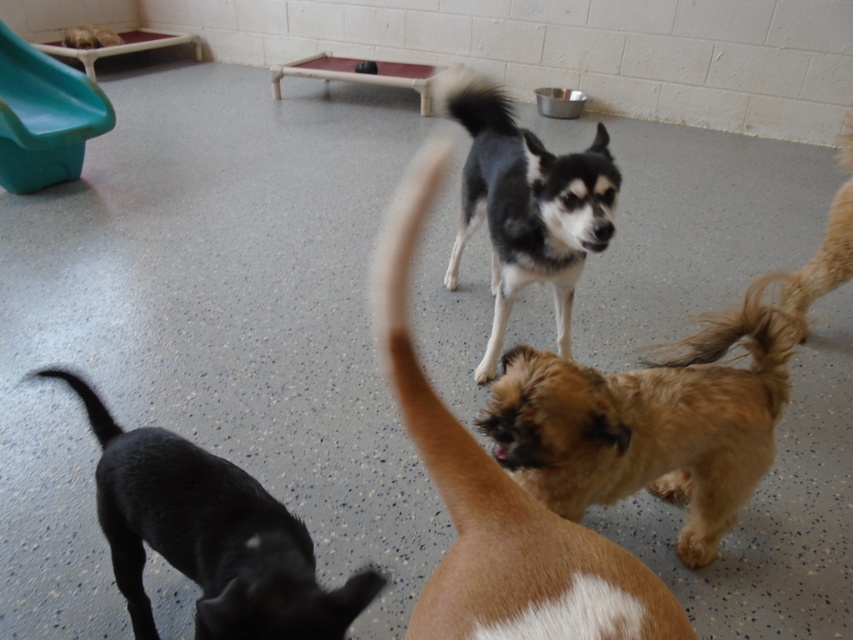
Question: Does light brown fur at center come behind black and white fur at center?

Choices:
 (A) no
 (B) yes

Answer: (A)

Question: Which point is farther to the camera?

Choices:
 (A) (641, 586)
 (B) (529, 472)
 (C) (77, 390)

Answer: (B)

Question: Which object is farther from the camera taking this photo?

Choices:
 (A) light brown fur at center
 (B) short-haired tan dog at center

Answer: (A)

Question: Can you confirm if short-haired tan dog at center is positioned to the right of black fur tail at lower left?

Choices:
 (A) yes
 (B) no

Answer: (A)

Question: Is light brown fur at center to the right of short-haired tan dog at center from the viewer's perspective?

Choices:
 (A) no
 (B) yes

Answer: (B)

Question: Among these objects, which one is nearest to the camera?

Choices:
 (A) light brown fur at center
 (B) short-haired tan dog at center
 (C) black fur tail at lower left
 (D) black matte dog at lower left

Answer: (B)